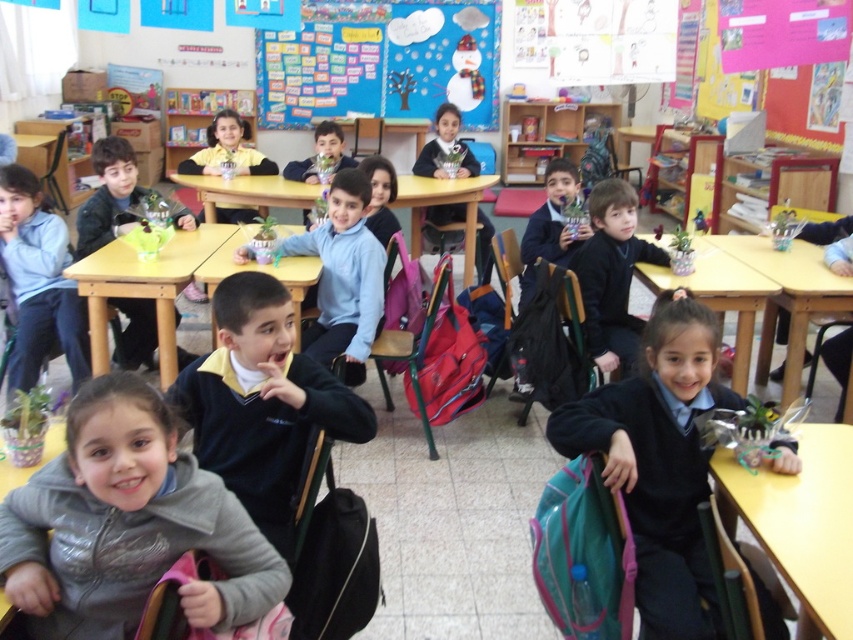
Is point (134, 320) closer to camera compared to point (546, 221)?

Yes, point (134, 320) is closer to viewer.

This screenshot has height=640, width=853. What do you see at coordinates (108, 195) in the screenshot? I see `matte black jacket at left` at bounding box center [108, 195].

At what (x,y) coordinates should I click in order to perform the action: click on matte black jacket at left. Please return your answer as a coordinate pair (x, y). This screenshot has height=640, width=853. Looking at the image, I should click on (108, 195).

Is point (318, 188) less distant than point (231, 256)?

No.

What do you see at coordinates (444, 204) in the screenshot?
I see `wooden table at center` at bounding box center [444, 204].

Locate an element on the screen. This screenshot has width=853, height=640. wooden table at center is located at coordinates (444, 204).

Which is behind, point (618, 244) or point (225, 241)?

Positioned behind is point (225, 241).

The width and height of the screenshot is (853, 640). I want to click on matte black sweater at center, so click(612, 275).